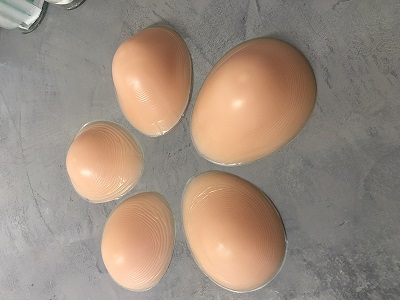
Where is `stone table`? This screenshot has width=400, height=300. stone table is located at coordinates point(40,114).